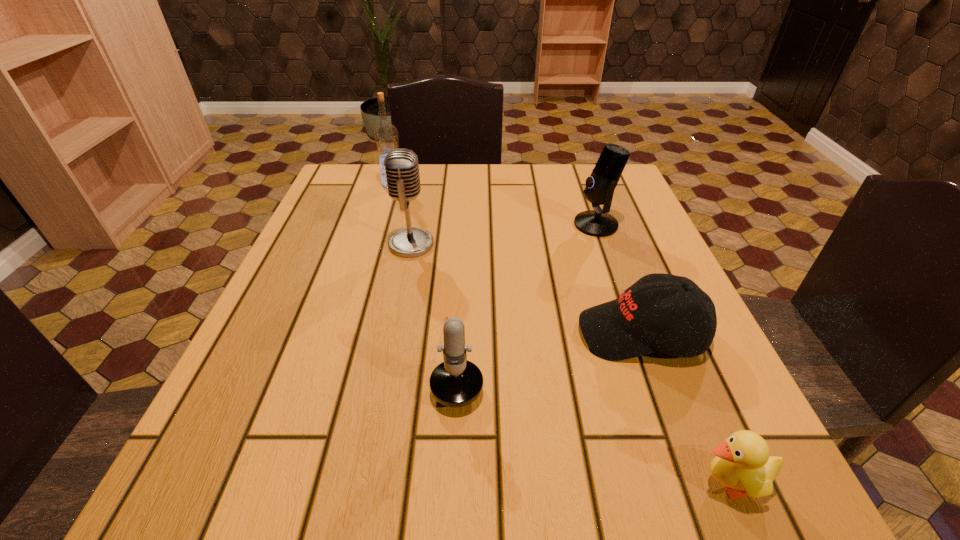
Find the location of `the leftmost object`. the leftmost object is located at coordinates (386, 138).

Locate an element on the screen. The image size is (960, 540). the farthest object is located at coordinates (386, 138).

This screenshot has width=960, height=540. I want to click on the fifth object from right to left, so click(401, 166).

This screenshot has height=540, width=960. I want to click on the rightmost microphone, so click(600, 186).

Locate an element on the screen. The width and height of the screenshot is (960, 540). the third shortest object is located at coordinates (456, 382).

Locate an element on the screen. This screenshot has width=960, height=540. the nearest microphone is located at coordinates (456, 382).

The image size is (960, 540). Identify the location of baseball cap. (630, 326).

Image resolution: width=960 pixels, height=540 pixels. What are the coordinates of `the nearest object` in the screenshot? It's located at (743, 464).

Image resolution: width=960 pixels, height=540 pixels. I want to click on vacant space situated 0.240m on the right of the farthest object, so click(x=497, y=184).

Locate an element on the screen. The height and width of the screenshot is (540, 960). vacant space located on the front of the leftmost microphone is located at coordinates (383, 390).